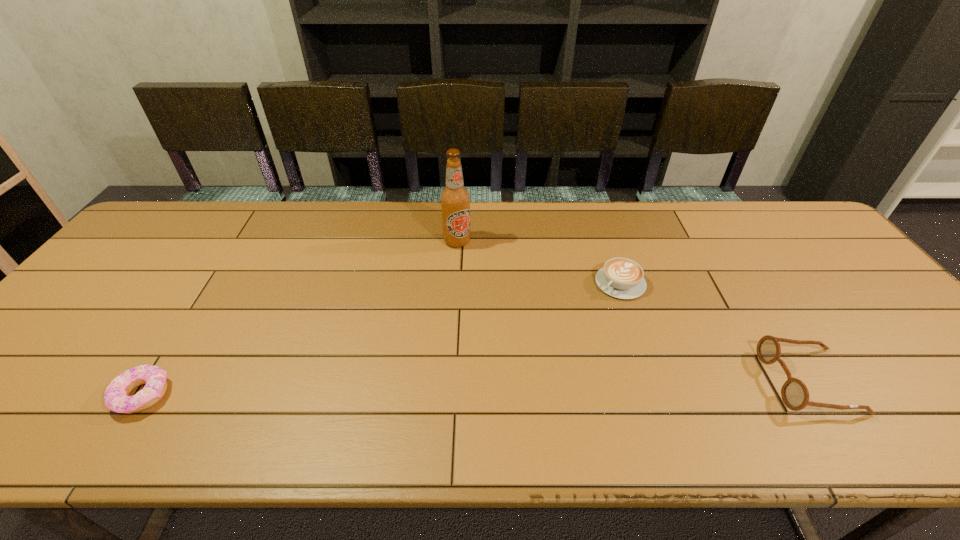
Image resolution: width=960 pixels, height=540 pixels. I want to click on free spot on the desktop that is between the doughnut and the rightmost object and is positioned on the side of the third nearest object with the handle, so click(502, 387).

I want to click on free spot on the desktop that is between the doughnut and the rightmost object and is positioned on the front label of the tallest object, so click(x=504, y=387).